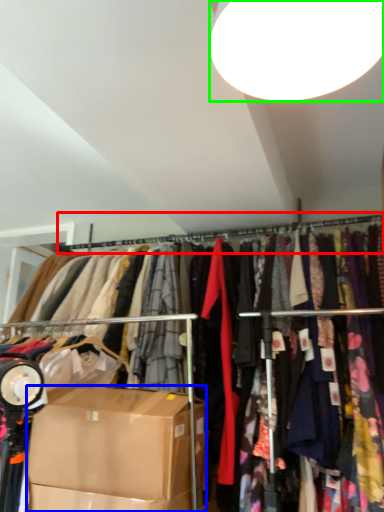
Question: Which is farther away from clothesline (highlighted by a red box)? box (highlighted by a blue box) or lamp (highlighted by a green box)?

Choices:
 (A) box
 (B) lamp

Answer: (B)